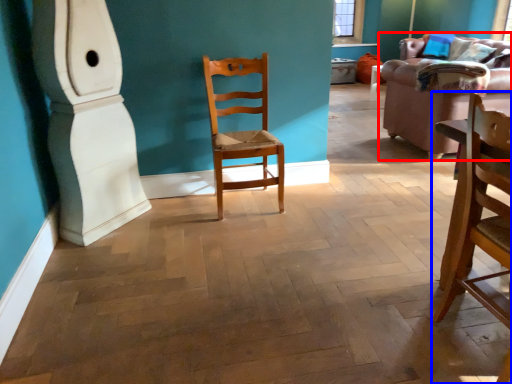
Question: Which object is closer to the camera taking this photo, studio couch (highlighted by a red box) or chair (highlighted by a blue box)?

Choices:
 (A) studio couch
 (B) chair

Answer: (B)